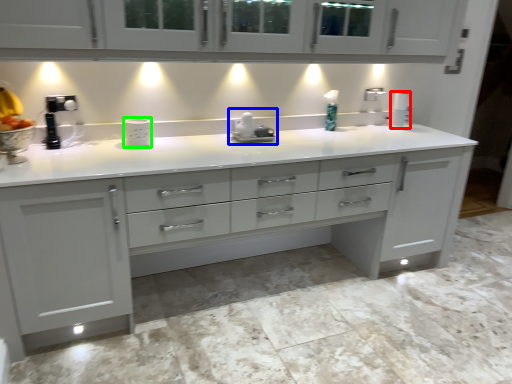
Question: Estimate the real-world distances between objects in this image. Which object is farther from paper towel (highlighted by a red box), appliance (highlighted by a blue box) or appliance (highlighted by a green box)?

Choices:
 (A) appliance
 (B) appliance

Answer: (B)